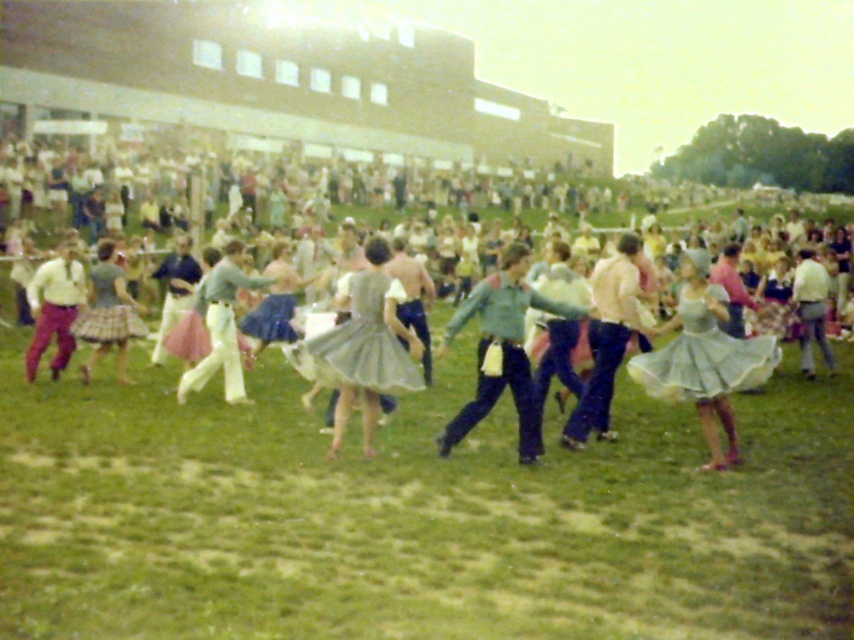
Question: Which of the following is the farthest from the observer?

Choices:
 (A) green fabric skirt at center
 (B) green satin dress at center
 (C) light blue denim skirt at center
 (D) green grass at center

Answer: (A)

Question: Does green grass at center have a smaller size compared to green fabric skirt at center?

Choices:
 (A) yes
 (B) no

Answer: (B)

Question: Which is nearer to the green grass at center?

Choices:
 (A) plaid fabric skirt at center
 (B) light blue denim skirt at center
 (C) green satin dress at center

Answer: (B)

Question: Which object is the closest to the light green skirt at center?

Choices:
 (A) light gray taffeta skirt at center
 (B) green grass at center
 (C) light green fabric skirt at center
 (D) light blue denim skirt at center

Answer: (A)

Question: Can you confirm if green grass at center is positioned to the right of green satin dress at center?

Choices:
 (A) no
 (B) yes

Answer: (A)

Question: Can you confirm if light green skirt at center is bigger than green fabric skirt at center?

Choices:
 (A) no
 (B) yes

Answer: (B)